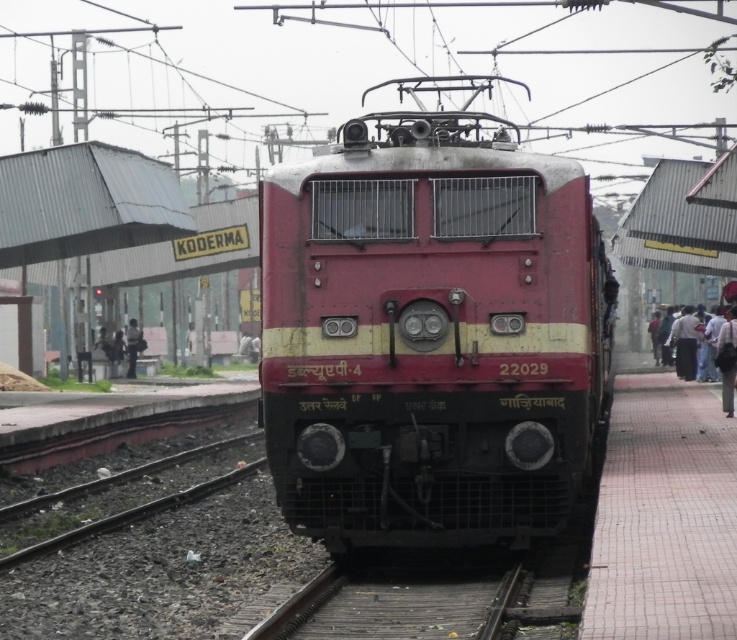
Can you confirm if brown wooden train track at center is positioned above dark gray fabric pants at right?

No.

Is brown wooden train track at center wider than dark gray fabric pants at right?

Yes.

You are a GUI agent. You are given a task and a screenshot of the screen. Output one action in this format:
    pyautogui.click(x=<x>, y=<y>)
    Task: Click on the brown wooden train track at center
    
    Given the screenshot: What is the action you would take?
    pyautogui.click(x=394, y=604)

Between brown wooden train track at center and dark blue jeans at right, which one appears on the right side from the viewer's perspective?

dark blue jeans at right

Is brown wooden train track at center bigger than dark blue jeans at right?

Yes.

Where is `brown wooden train track at center`? Image resolution: width=737 pixels, height=640 pixels. brown wooden train track at center is located at coordinates (394, 604).

Does point (388, 593) come farther from viewer compared to point (130, 336)?

No, (388, 593) is closer to viewer.

Is brown wooden train track at center below dark gray fabric jacket at left?

Correct, brown wooden train track at center is located below dark gray fabric jacket at left.

Is point (321, 608) farther from camera compared to point (133, 371)?

No, (321, 608) is in front of (133, 371).

This screenshot has width=737, height=640. I want to click on brown wooden train track at center, so click(x=394, y=604).